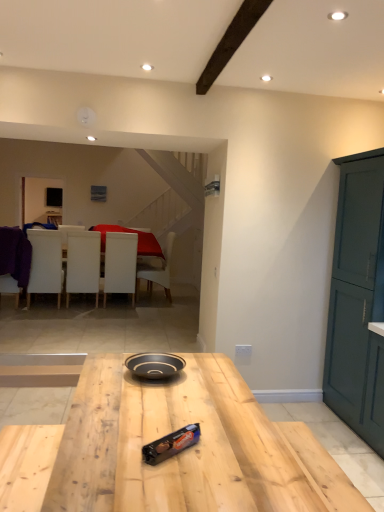
Question: Based on their sizes in the image, would you say purple fabric chair at left, the 5th chair in the right-to-left sequence, is bigger or smaller than white matte chair at left, acting as the 4th chair starting from the right?

Choices:
 (A) big
 (B) small

Answer: (B)

Question: From the image's perspective, is purple fabric chair at left, the 5th chair in the right-to-left sequence, located above or below white matte chair at left, the 2th chair in the left-to-right sequence?

Choices:
 (A) above
 (B) below

Answer: (A)

Question: Estimate the real-world distances between objects in this image. Which object is closer to the white leather chair at center, which appears as the fifth chair when viewed from the left?

Choices:
 (A) natural wood table at center
 (B) matte black bowl at center
 (C) white matte chair at center, arranged as the third chair when viewed from the left
 (D) shiny chocolate bar at center
 (E) white matte chair at left, acting as the 4th chair starting from the right

Answer: (C)

Question: Estimate the real-world distances between objects in this image. Which object is farther from the white matte chair at center, the 2th chair from the right?

Choices:
 (A) matte black bowl at center
 (B) white matte chair at left, acting as the 4th chair starting from the right
 (C) teal matte cabinet at right
 (D) shiny chocolate bar at center
 (E) white leather chair at center, which appears as the fifth chair when viewed from the left

Answer: (D)